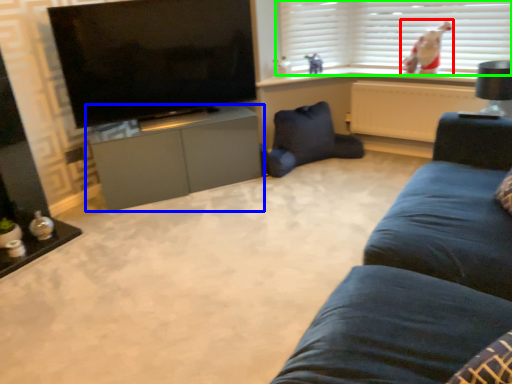
Question: Based on their relative distances, which object is nearer to person (highlighted by a red box)? Choose from cabinetry (highlighted by a blue box) and window blind (highlighted by a green box).

Choices:
 (A) cabinetry
 (B) window blind

Answer: (B)